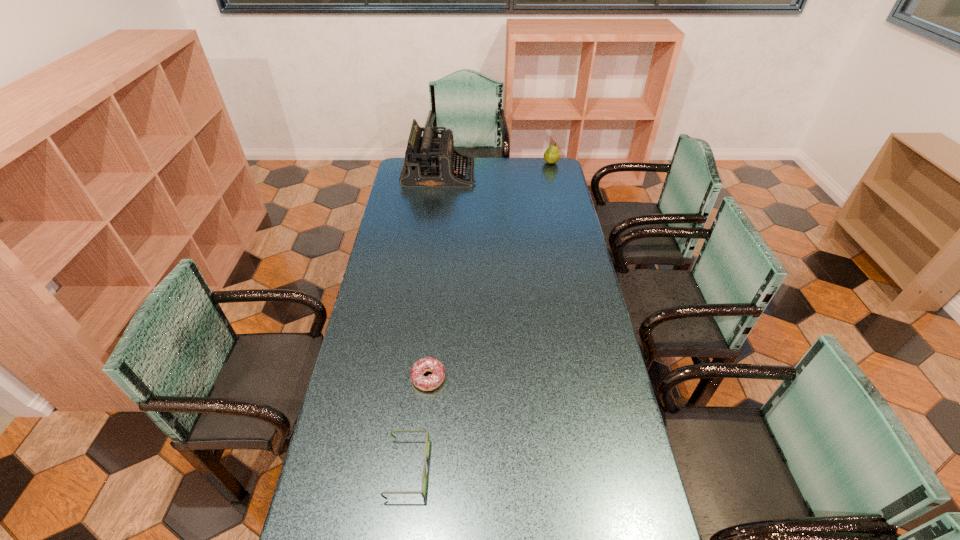
Locate an element on the screen. free space that satisfies the following two spatial constraints: 1. on the back side of the pear; 2. on the left side of the third farthest object is located at coordinates (449, 163).

You are a GUI agent. You are given a task and a screenshot of the screen. Output one action in this format:
    pyautogui.click(x=<x>, y=<y>)
    Task: Click on the free space that satisfies the following two spatial constraints: 1. on the keyboard of the shortest object; 2. on the left side of the tallest object
    The image size is (960, 540).
    Given the screenshot: What is the action you would take?
    pyautogui.click(x=414, y=378)

At what (x,y) coordinates should I click in order to perform the action: click on free spot that satisfies the following two spatial constraints: 1. on the keyboard of the typewriter; 2. on the back side of the third farthest object. Please return your answer as a coordinate pair (x, y). Looking at the image, I should click on (414, 378).

You are a GUI agent. You are given a task and a screenshot of the screen. Output one action in this format:
    pyautogui.click(x=<x>, y=<y>)
    Task: Click on the free point that satisfies the following two spatial constraints: 1. on the back side of the doughnut; 2. on the keyboard of the typewriter
    The image size is (960, 540).
    Given the screenshot: What is the action you would take?
    pyautogui.click(x=448, y=174)

At what (x,y) coordinates should I click in order to perform the action: click on vacant area in the image that satisfies the following two spatial constraints: 1. on the keyboard of the tallest object; 2. on the left side of the shortest object. Please return your answer as a coordinate pair (x, y). This screenshot has width=960, height=540. Looking at the image, I should click on (414, 378).

What are the coordinates of `free space that satisfies the following two spatial constraints: 1. on the keyboard of the typewriter; 2. on the back side of the second nearest object` in the screenshot? It's located at (414, 378).